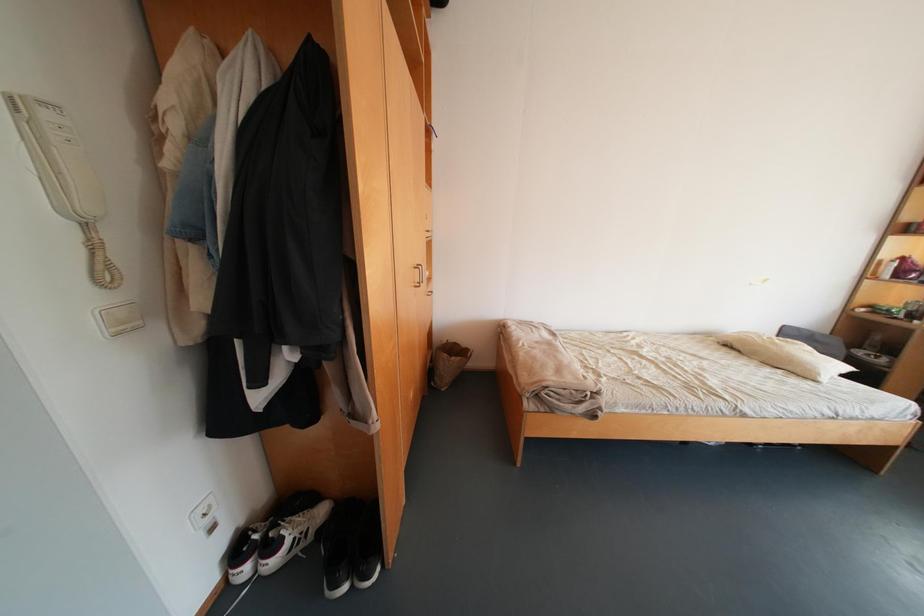
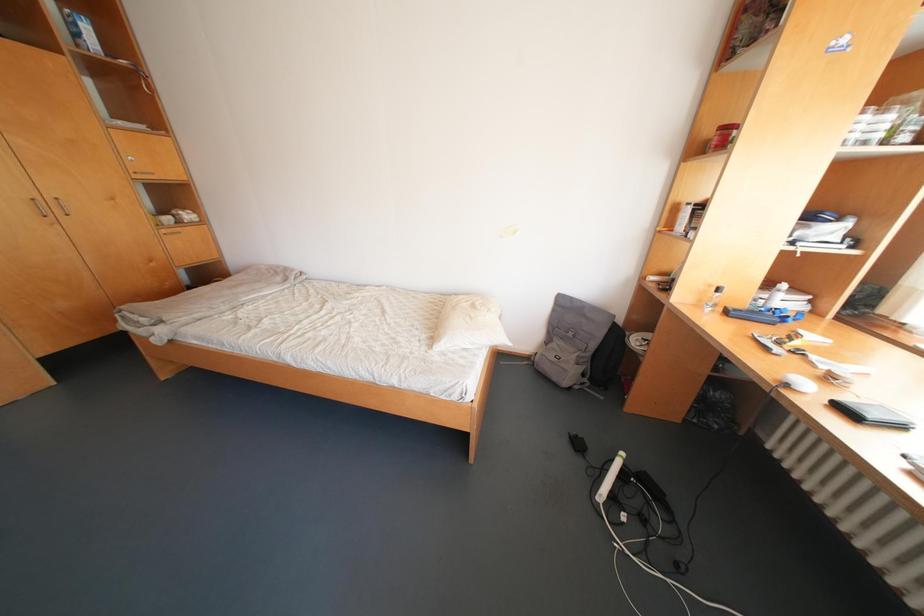
Question: Which direction would the cameraman need to move to produce the second image? Reply with the corresponding letter.

Choices:
 (A) Left
 (B) Right
 (C) Forward
 (D) Backward

Answer: (B)